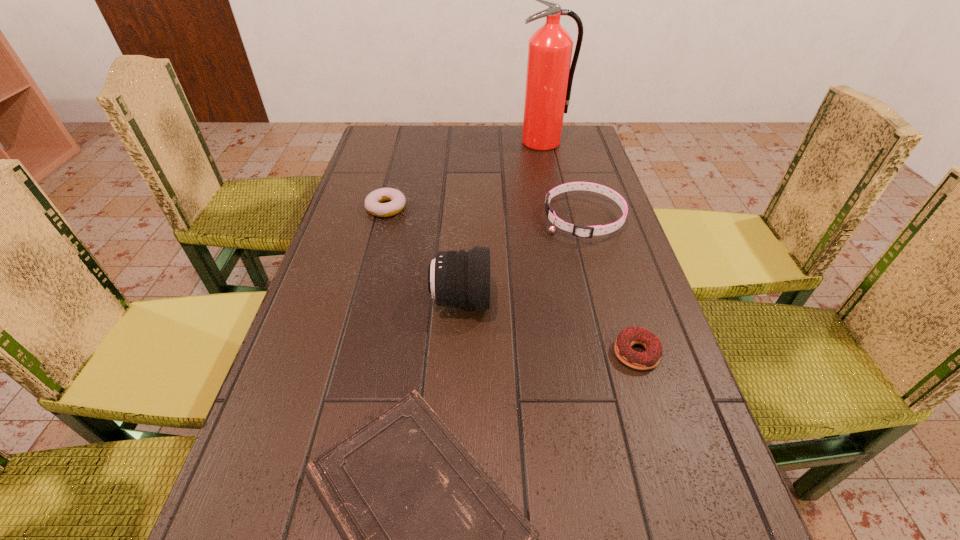
Find the location of a particular element. This screenshot has width=960, height=540. object at the far right corner is located at coordinates (549, 77).

This screenshot has height=540, width=960. In the image, there is a desktop. Find the location of `free space at the far edge`. free space at the far edge is located at coordinates (471, 138).

The height and width of the screenshot is (540, 960). In the image, there is a desktop. Identify the location of free space at the left edge. (349, 268).

Where is `vacant space at the right edge of the desktop`? vacant space at the right edge of the desktop is located at coordinates (566, 206).

At what (x,y) coordinates should I click in order to perform the action: click on free spot between the nearer doughnut and the tallest object. Please return your answer as a coordinate pair (x, y). This screenshot has width=960, height=540. Looking at the image, I should click on (589, 247).

This screenshot has height=540, width=960. What are the coordinates of `free area in between the left doughnut and the third nearest object` in the screenshot? It's located at (423, 254).

Locate an element on the screen. free point between the fourth shortest object and the nearer doughnut is located at coordinates (610, 286).

What are the coordinates of `free space between the second nearest object and the third tallest object` in the screenshot? It's located at (610, 286).

Locate an element on the screen. Image resolution: width=960 pixels, height=540 pixels. vacant point located between the third tallest object and the fire extinguisher is located at coordinates coord(564,181).

Identify the location of free space that is in between the third nearest object and the farthest object. (502, 221).